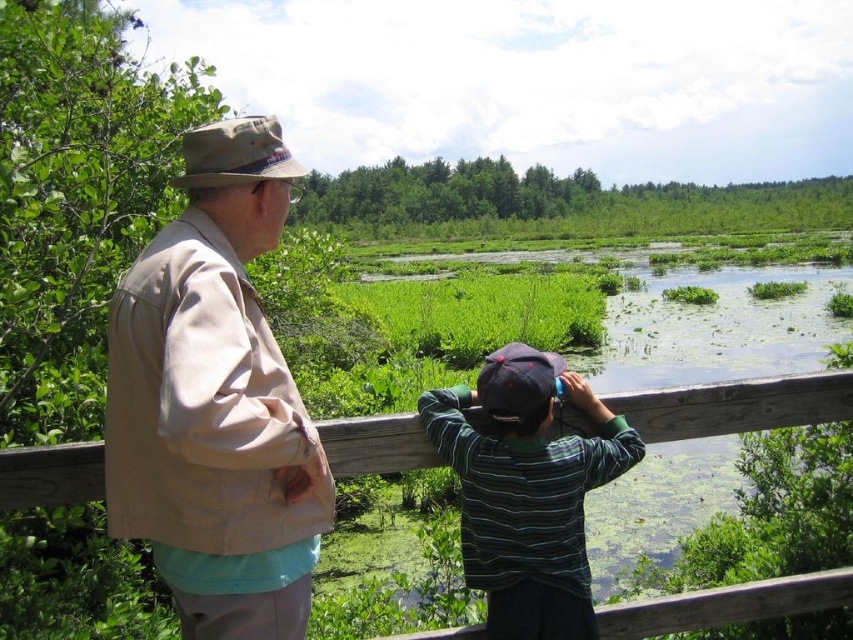
You are a tour guide leading a group and need to ensure that all visitors maintain a social distance of at least 3 feet. You notice the khaki fabric jacket at upper left and the green striped shirt at center in the scene. Are these two individuals following the social distancing guidelines?

The distance between the khaki fabric jacket at upper left and the green striped shirt at center is 31.52 inches, which is less than 3 feet. Therefore, they are not following the social distancing guidelines.

You are a photographer trying to capture both the khaki fabric jacket at upper left and the wooden fence at center in a single frame. Based on their heights, which object should you focus on first to ensure both are in the shot?

The khaki fabric jacket at upper left is much taller than the wooden fence at center, so you should focus on the khaki fabric jacket at upper left first to ensure both are in the shot.